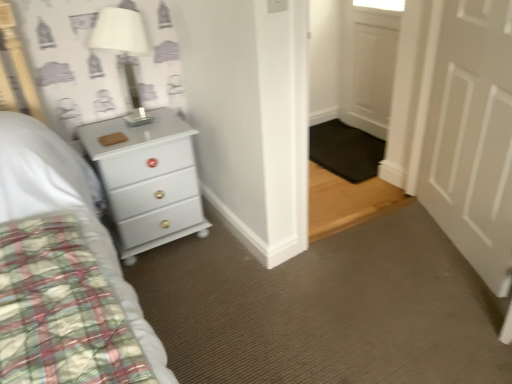
Question: From a real-world perspective, is white wooden door at upper right, the second door positioned from the front, located higher than white matte lampshade at upper left?

Choices:
 (A) yes
 (B) no

Answer: (B)

Question: Is white wooden door at upper right, the 1th door from the back, wider than white matte lampshade at upper left?

Choices:
 (A) yes
 (B) no

Answer: (B)

Question: Is white wooden door at upper right, the second door positioned from the front, further to the viewer compared to white matte lampshade at upper left?

Choices:
 (A) yes
 (B) no

Answer: (A)

Question: Is white wooden door at upper right, the second door positioned from the front, taller than white matte lampshade at upper left?

Choices:
 (A) yes
 (B) no

Answer: (A)

Question: Is white wooden door at upper right, the second door positioned from the front, shorter than white matte lampshade at upper left?

Choices:
 (A) no
 (B) yes

Answer: (A)

Question: Considering the relative sizes of white wooden door at upper right, the second door positioned from the front, and white matte lampshade at upper left in the image provided, is white wooden door at upper right, the second door positioned from the front, smaller than white matte lampshade at upper left?

Choices:
 (A) yes
 (B) no

Answer: (A)

Question: Is white matte door at right, which is the first door from front to back, outside white matte lampshade at upper left?

Choices:
 (A) no
 (B) yes

Answer: (B)

Question: Can you confirm if white matte door at right, which is the first door from front to back, is positioned to the right of white matte lampshade at upper left?

Choices:
 (A) no
 (B) yes

Answer: (B)

Question: Is white matte door at right, which is the first door from front to back, thinner than white matte lampshade at upper left?

Choices:
 (A) yes
 (B) no

Answer: (A)

Question: Is white matte door at right, which is the first door from front to back, looking in the opposite direction of white matte lampshade at upper left?

Choices:
 (A) yes
 (B) no

Answer: (B)

Question: Does white matte door at right, which is the first door from front to back, appear on the left side of white matte lampshade at upper left?

Choices:
 (A) yes
 (B) no

Answer: (B)

Question: From the image's perspective, is white matte door at right, which is counted as the second door, starting from the back, located beneath white matte lampshade at upper left?

Choices:
 (A) yes
 (B) no

Answer: (A)

Question: Is white matte lampshade at upper left next to white glossy chest of drawers at left and touching it?

Choices:
 (A) no
 (B) yes

Answer: (A)